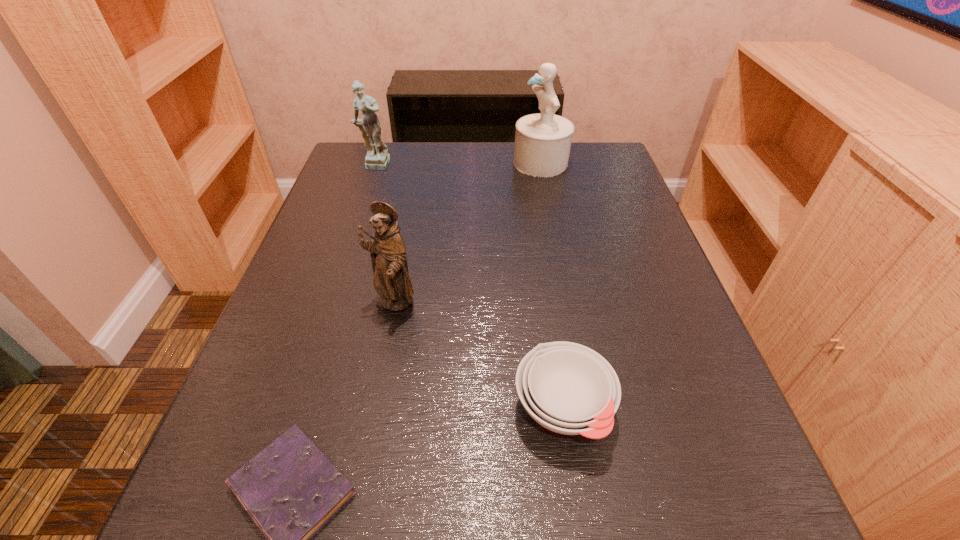
The height and width of the screenshot is (540, 960). I want to click on vacant region between the rightmost figurine and the leftmost figurine, so click(458, 165).

Locate an element on the screen. The height and width of the screenshot is (540, 960). object that is the third closest one to the soup bowl is located at coordinates (543, 140).

Locate which object is the fourth closest to the rightmost figurine. Please provide its 2D coordinates. Your answer should be formatted as a tuple, i.e. [(x, y)], where the tuple contains the x and y coordinates of a point satisfying the conditions above.

[(290, 490)]

In order to click on the closest figurine to the fourth tallest object in this screenshot , I will do `click(391, 280)`.

At what (x,y) coordinates should I click in order to perform the action: click on the closest figurine to the third nearest object. Please return your answer as a coordinate pair (x, y). Looking at the image, I should click on (377, 158).

Locate an element on the screen. This screenshot has height=540, width=960. free spot that satisfies the following two spatial constraints: 1. at the beak of the rightmost figurine; 2. on the front-facing side of the leftmost figurine is located at coordinates (541, 166).

Image resolution: width=960 pixels, height=540 pixels. Identify the location of free space that satisfies the following two spatial constraints: 1. on the front-facing side of the fourth tallest object; 2. on the right side of the leftmost figurine. (293, 409).

Image resolution: width=960 pixels, height=540 pixels. Identify the location of vacant space that satisfies the following two spatial constraints: 1. at the beak of the rightmost figurine; 2. on the front-facing side of the leftmost figurine. (541, 166).

Locate an element on the screen. vacant area that satisfies the following two spatial constraints: 1. on the front-facing side of the soup bowl; 2. on the left side of the leftmost figurine is located at coordinates [x=293, y=409].

Identify the location of free point that satisfies the following two spatial constraints: 1. at the beak of the rightmost figurine; 2. on the front-facing side of the leftmost figurine. (541, 166).